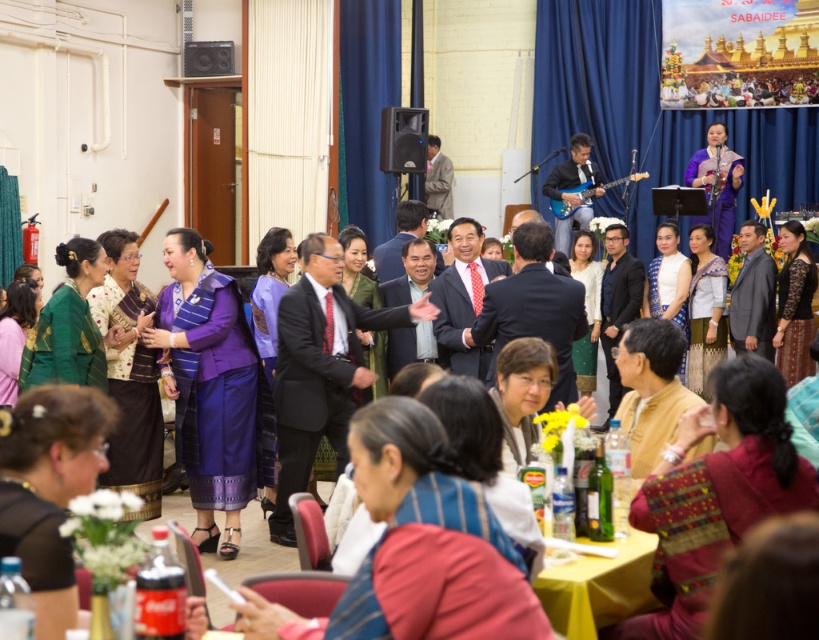
Question: Which point is farther to the camera?

Choices:
 (A) purple satin dress at center
 (B) yellow fabric table at lower center
 (C) matte black speaker at upper left
 (D) embroidered silk dress at lower right

Answer: (C)

Question: Is purple satin dress at center smaller than satin blue guitar at center?

Choices:
 (A) yes
 (B) no

Answer: (A)

Question: Which of these objects is positioned closest to the satin blue guitar at center?

Choices:
 (A) purple satin dress at center
 (B) matte purple dress at center

Answer: (A)

Question: Does satin blue guitar at center appear on the right side of matte black speaker at upper left?

Choices:
 (A) no
 (B) yes

Answer: (B)

Question: Estimate the real-world distances between objects in this image. Which object is farther from the embroidered silk dress at lower right?

Choices:
 (A) matte black speaker at upper left
 (B) purple satin dress at upper center

Answer: (A)

Question: Is embroidered silk dress at lower right below yellow fabric table at lower center?

Choices:
 (A) no
 (B) yes

Answer: (A)